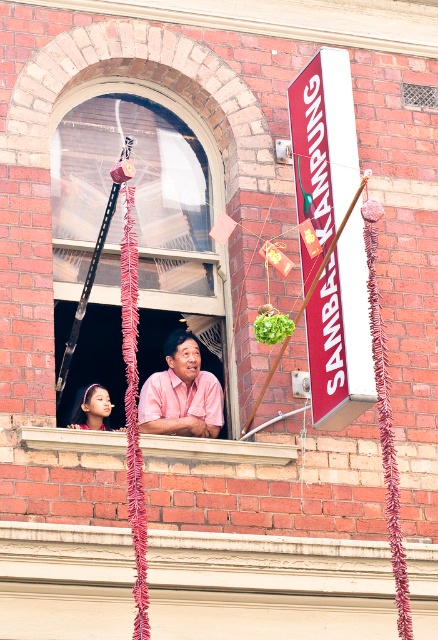
Who is higher up, clear glass window at center or pink matte shirt at window?

clear glass window at center

Is clear glass window at center further to the viewer compared to pink matte shirt at window?

Yes, it is behind pink matte shirt at window.

Between point (166, 96) and point (194, 406), which one is positioned in front?

Point (194, 406)

Locate an element on the screen. clear glass window at center is located at coordinates (140, 193).

Which is more to the left, clear glass window at center or smooth skin face at window left?

From the viewer's perspective, smooth skin face at window left appears more on the left side.

Does point (159, 102) come closer to viewer compared to point (108, 426)?

That is False.

Which is behind, point (172, 131) or point (78, 417)?

Point (172, 131)

This screenshot has height=640, width=438. Find the location of `clear glass window at center`. clear glass window at center is located at coordinates (140, 193).

Does point (82, 182) come in front of point (46, 445)?

That is False.

Which is above, clear glass window at center or wooden at lower center?

clear glass window at center is above.

Does point (162, 164) lie behind point (163, 448)?

Yes, point (162, 164) is behind point (163, 448).

At what (x,y) coordinates should I click in order to perform the action: click on clear glass window at center. Please return your answer as a coordinate pair (x, y). This screenshot has height=640, width=438. Looking at the image, I should click on (140, 193).